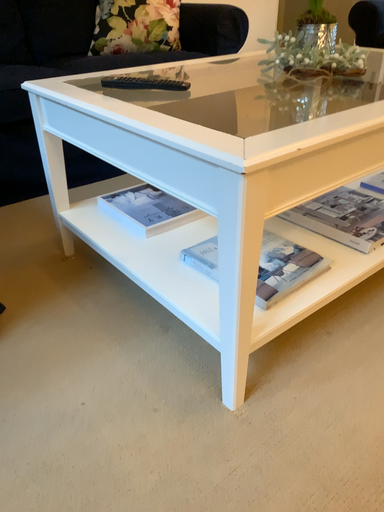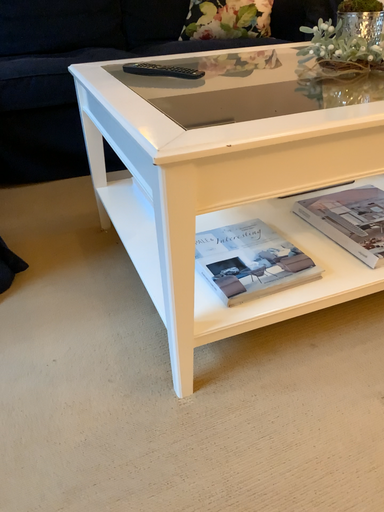
Question: Which way did the camera rotate in the video?

Choices:
 (A) rotated right
 (B) rotated left

Answer: (B)